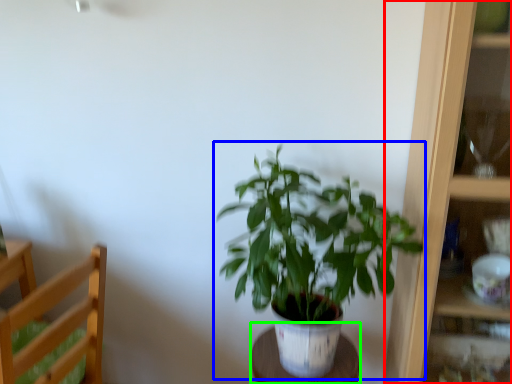
Question: Which object is the closest to the cabinet (highlighted by a red box)? Choose among these: houseplant (highlighted by a blue box) or table (highlighted by a green box).

Choices:
 (A) houseplant
 (B) table

Answer: (A)